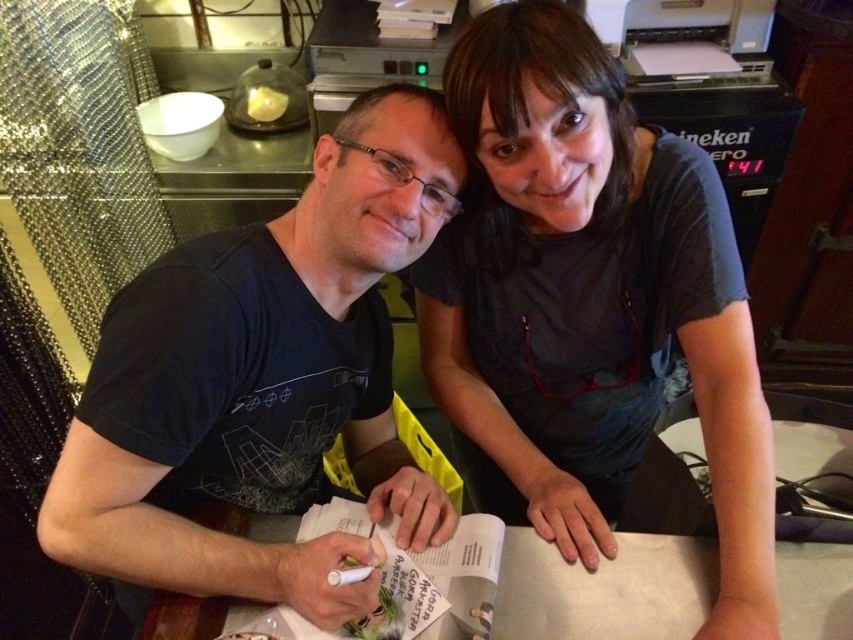
Which is in front, point (242, 417) or point (535, 557)?

Point (242, 417) is more forward.

Between point (102, 339) and point (805, 576), which one is positioned in front?

Positioned in front is point (102, 339).

Identify the location of black matte t-shirt at left. (265, 378).

Does dark gray shirt at upper center come in front of black matte t-shirt at left?

No, dark gray shirt at upper center is further to the viewer.

Who is more forward, (715, 468) or (367, 307)?

Point (715, 468) is in front.

Is point (561, 324) farther from camera compared to point (106, 525)?

Yes.

Locate an element on the screen. dark gray shirt at upper center is located at coordinates (589, 304).

Is dark gray shirt at upper center above white paper at center?

Correct, dark gray shirt at upper center is located above white paper at center.

Is dark gray shirt at upper center shorter than white paper at center?

In fact, dark gray shirt at upper center may be taller than white paper at center.

Between point (448, 273) and point (213, 524), which one is positioned in front?

Point (213, 524) is in front.

The height and width of the screenshot is (640, 853). What are the coordinates of `dark gray shirt at upper center` in the screenshot? It's located at (589, 304).